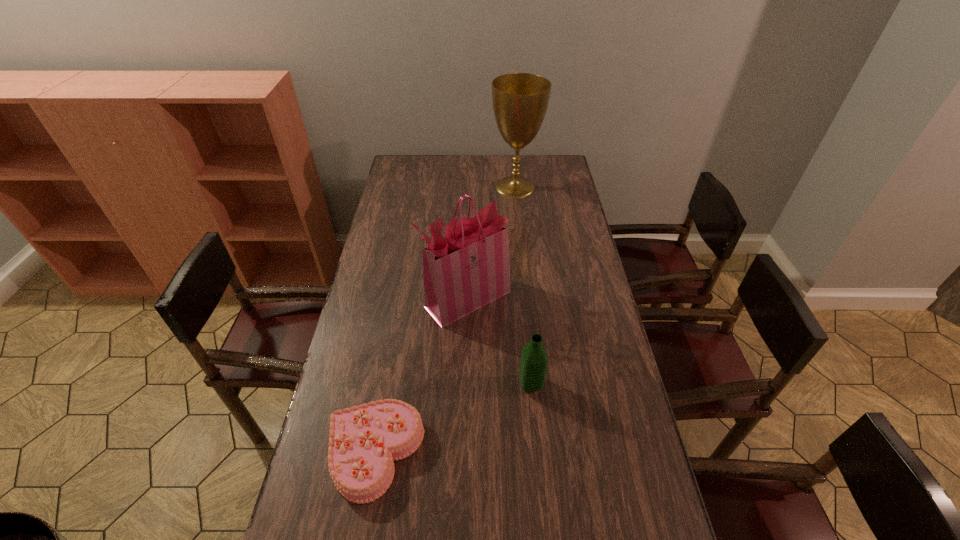
This screenshot has height=540, width=960. I want to click on trophy cup, so click(x=520, y=100).

Identify the location of shopping bag. (469, 268).

You are a GUI agent. You are given a task and a screenshot of the screen. Output one action in this format:
    pyautogui.click(x=<x>, y=<y>)
    Task: Click on the water bottle
    The width and height of the screenshot is (960, 540).
    Given the screenshot: What is the action you would take?
    pyautogui.click(x=534, y=360)

Locate an element on the screen. the second nearest object is located at coordinates (534, 360).

Locate an element on the screen. This screenshot has width=960, height=540. the nearest object is located at coordinates (365, 440).

Image resolution: width=960 pixels, height=540 pixels. Identify the location of cake. (365, 440).

Where is `vacant space located on the front of the farthest object`? The height and width of the screenshot is (540, 960). vacant space located on the front of the farthest object is located at coordinates (517, 213).

At what (x,y) coordinates should I click in order to perform the action: click on vacant space located on the front of the third nearest object. Please return your answer as a coordinate pair (x, y). The width and height of the screenshot is (960, 540). Looking at the image, I should click on (465, 382).

Find the location of a particular element. The width and height of the screenshot is (960, 540). vacant space situated on the front of the second nearest object is located at coordinates (539, 466).

At what (x,y) coordinates should I click in order to perform the action: click on vacant space located on the back of the nearest object. Please return your answer as a coordinate pair (x, y). The height and width of the screenshot is (540, 960). Looking at the image, I should click on (394, 347).